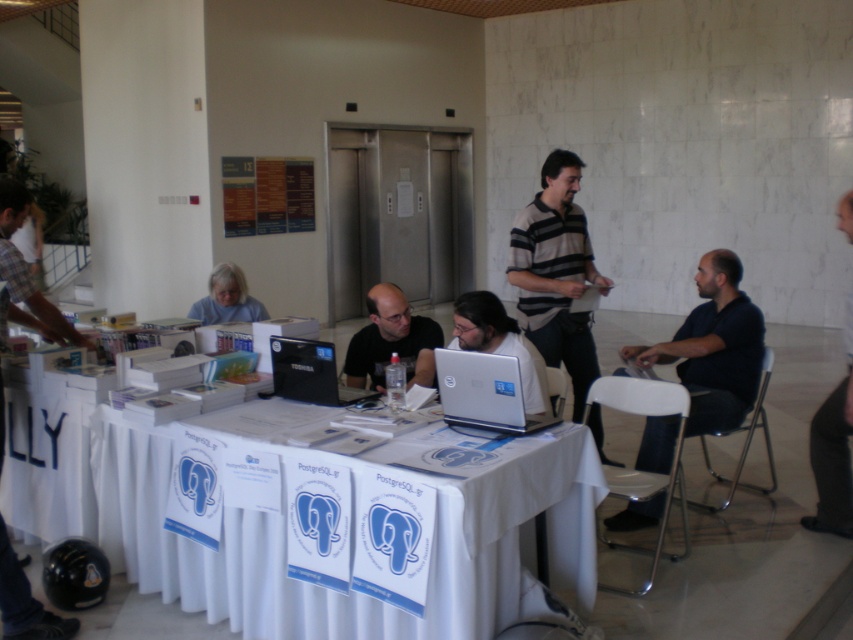
Question: From the image, what is the correct spatial relationship of silver metallic laptop at center in relation to black glossy laptop at center?

Choices:
 (A) above
 (B) below

Answer: (A)

Question: Which point appears farthest from the camera in this image?

Choices:
 (A) (583, 316)
 (B) (399, 301)

Answer: (A)

Question: Which object appears closest to the camera in this image?

Choices:
 (A) black fabric shirt at right
 (B) black glossy laptop at center
 (C) shiny silver laptop at center

Answer: (C)

Question: Is shiny silver laptop at center thinner than gray matte shirt at lower left?

Choices:
 (A) yes
 (B) no

Answer: (A)

Question: Does white cloth at center appear under black matte shirt at center?

Choices:
 (A) no
 (B) yes

Answer: (B)

Question: Which object is farther from the camera taking this photo?

Choices:
 (A) gray matte shirt at lower left
 (B) shiny silver laptop at center
 (C) black fabric shirt at right
 (D) dark blue shirt at center

Answer: (A)